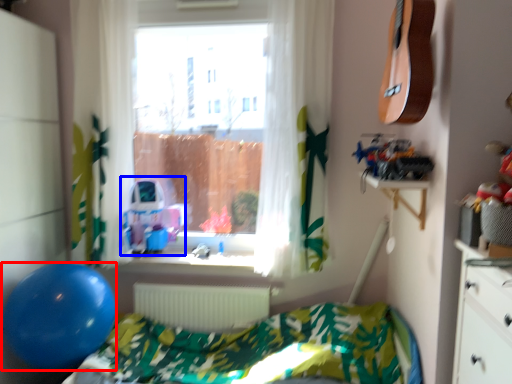
Question: Which of the following is the closest to the observer, balloon (highlighted by a red box) or toy (highlighted by a blue box)?

Choices:
 (A) balloon
 (B) toy

Answer: (A)